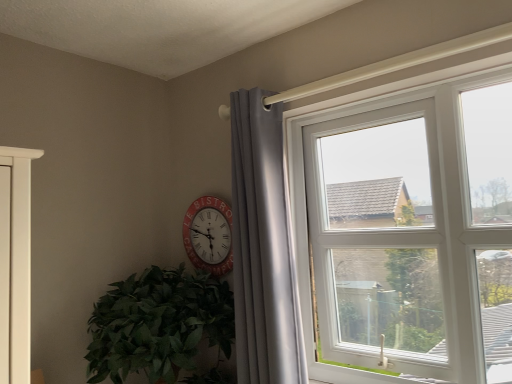
Question: Does green leafy plant at lower left have a lesser height compared to white plastic window at upper right?

Choices:
 (A) yes
 (B) no

Answer: (A)

Question: Is green leafy plant at lower left aimed at white plastic window at upper right?

Choices:
 (A) yes
 (B) no

Answer: (B)

Question: Considering the relative sizes of green leafy plant at lower left and white plastic window at upper right in the image provided, is green leafy plant at lower left taller than white plastic window at upper right?

Choices:
 (A) yes
 (B) no

Answer: (B)

Question: From a real-world perspective, is green leafy plant at lower left over white plastic window at upper right?

Choices:
 (A) no
 (B) yes

Answer: (A)

Question: From the image's perspective, is green leafy plant at lower left above white plastic window at upper right?

Choices:
 (A) yes
 (B) no

Answer: (B)

Question: From a real-world perspective, relative to green leafy plant at lower left, is white plastic window at upper right vertically above or below?

Choices:
 (A) above
 (B) below

Answer: (A)

Question: From their relative heights in the image, would you say white plastic window at upper right is taller or shorter than green leafy plant at lower left?

Choices:
 (A) tall
 (B) short

Answer: (A)

Question: Would you say white plastic window at upper right is to the left or to the right of green leafy plant at lower left in the picture?

Choices:
 (A) right
 (B) left

Answer: (A)

Question: Considering the positions of point (294, 193) and point (115, 340), is point (294, 193) closer or farther from the camera than point (115, 340)?

Choices:
 (A) closer
 (B) farther

Answer: (B)

Question: From the image's perspective, is white plastic window at upper right positioned above or below red plastic clock at center?

Choices:
 (A) below
 (B) above

Answer: (B)

Question: Is white plastic window at upper right wider or thinner than red plastic clock at center?

Choices:
 (A) thin
 (B) wide

Answer: (B)

Question: From a real-world perspective, relative to red plastic clock at center, is white plastic window at upper right vertically above or below?

Choices:
 (A) below
 (B) above

Answer: (A)

Question: Would you say white plastic window at upper right is to the left or to the right of red plastic clock at center in the picture?

Choices:
 (A) left
 (B) right

Answer: (B)

Question: Considering the positions of matte gray curtain at upper right and red plastic clock at center in the image, is matte gray curtain at upper right bigger or smaller than red plastic clock at center?

Choices:
 (A) small
 (B) big

Answer: (B)

Question: From a real-world perspective, is matte gray curtain at upper right physically located above or below red plastic clock at center?

Choices:
 (A) above
 (B) below

Answer: (B)